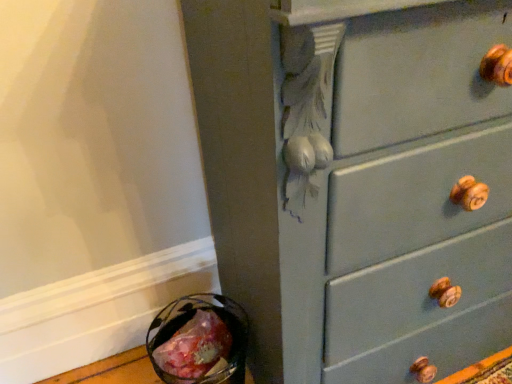
Question: Should I look upward or downward to see translucent plastic bag at lower left?

Choices:
 (A) up
 (B) down

Answer: (B)

Question: Is matte gray dresser at center-right at the left side of translucent plastic bag at lower left?

Choices:
 (A) no
 (B) yes

Answer: (A)

Question: Is matte gray dresser at center-right bigger than translucent plastic bag at lower left?

Choices:
 (A) yes
 (B) no

Answer: (A)

Question: Is the position of matte gray dresser at center-right more distant than that of translucent plastic bag at lower left?

Choices:
 (A) yes
 (B) no

Answer: (B)

Question: From the image's perspective, is matte gray dresser at center-right located beneath translucent plastic bag at lower left?

Choices:
 (A) no
 (B) yes

Answer: (A)

Question: Does matte gray dresser at center-right come in front of translucent plastic bag at lower left?

Choices:
 (A) no
 (B) yes

Answer: (B)

Question: Is matte gray dresser at center-right smaller than translucent plastic bag at lower left?

Choices:
 (A) no
 (B) yes

Answer: (A)

Question: From the image's perspective, is translucent plastic bag at lower left on matte gray dresser at center-right?

Choices:
 (A) yes
 (B) no

Answer: (B)

Question: Is translucent plastic bag at lower left turned away from matte gray dresser at center-right?

Choices:
 (A) yes
 (B) no

Answer: (B)

Question: Can you confirm if translucent plastic bag at lower left is shorter than matte gray dresser at center-right?

Choices:
 (A) no
 (B) yes

Answer: (B)

Question: Considering the relative sizes of translucent plastic bag at lower left and matte gray dresser at center-right in the image provided, is translucent plastic bag at lower left thinner than matte gray dresser at center-right?

Choices:
 (A) yes
 (B) no

Answer: (A)

Question: Does translucent plastic bag at lower left have a greater width compared to matte gray dresser at center-right?

Choices:
 (A) no
 (B) yes

Answer: (A)

Question: Does translucent plastic bag at lower left have a larger size compared to matte gray dresser at center-right?

Choices:
 (A) yes
 (B) no

Answer: (B)

Question: Considering the positions of matte gray dresser at center-right and translucent plastic bag at lower left in the image, is matte gray dresser at center-right wider or thinner than translucent plastic bag at lower left?

Choices:
 (A) thin
 (B) wide

Answer: (B)